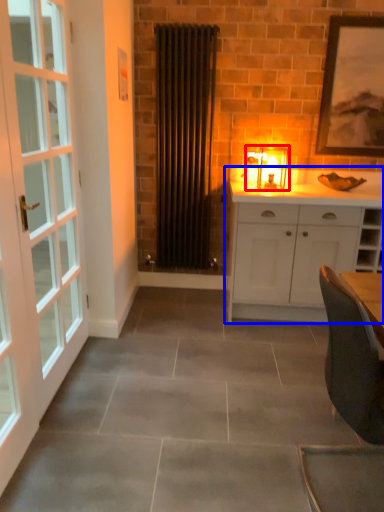
Question: Which point is further to the camera, light fixture (highlighted by a red box) or cabinetry (highlighted by a blue box)?

Choices:
 (A) light fixture
 (B) cabinetry

Answer: (A)